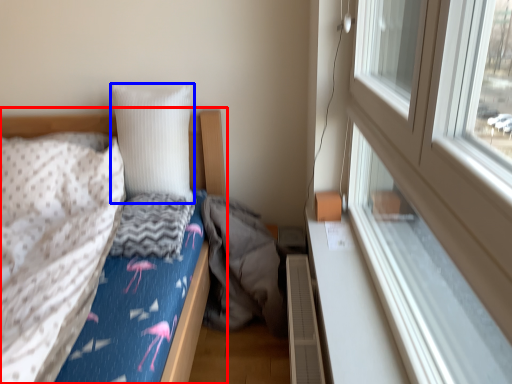
Question: Among these objects, which one is farthest to the camera, bed (highlighted by a red box) or pillow (highlighted by a blue box)?

Choices:
 (A) bed
 (B) pillow

Answer: (B)